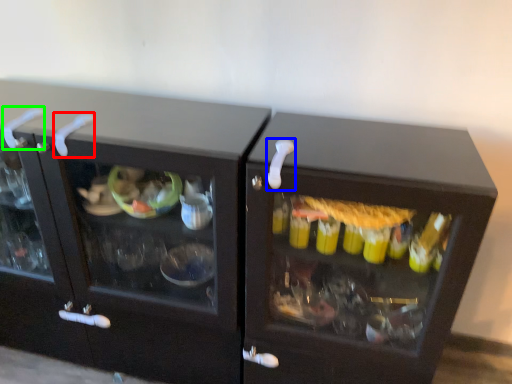
Question: Which object is the closest to the door handle (highlighted by a red box)? Choose among these: door handle (highlighted by a blue box) or door handle (highlighted by a green box).

Choices:
 (A) door handle
 (B) door handle

Answer: (B)